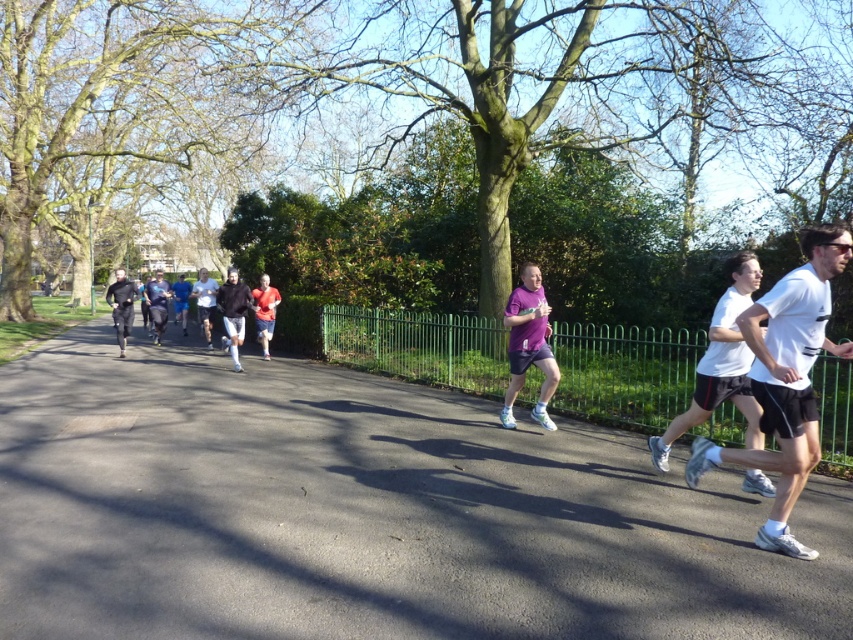
Question: Among these points, which one is farthest from the camera?

Choices:
 (A) (119, 300)
 (B) (229, 294)

Answer: (A)

Question: Is white matte shorts at center bigger than purple matte shorts at center?

Choices:
 (A) no
 (B) yes

Answer: (B)

Question: Is orange fabric shorts at center further to camera compared to dark blue fabric jacket at center?

Choices:
 (A) yes
 (B) no

Answer: (B)

Question: Which of these objects is positioned closest to the orange fabric shorts at center?

Choices:
 (A) white matte shorts at center
 (B) white matte shirt at center
 (C) asphalt road at center

Answer: (B)

Question: Is asphalt road at center smaller than dark blue fabric jacket at center?

Choices:
 (A) no
 (B) yes

Answer: (A)

Question: Among these points, which one is farthest from the camera?

Choices:
 (A) (207, 332)
 (B) (115, 339)
 (C) (268, 316)
 (D) (224, 284)

Answer: (B)